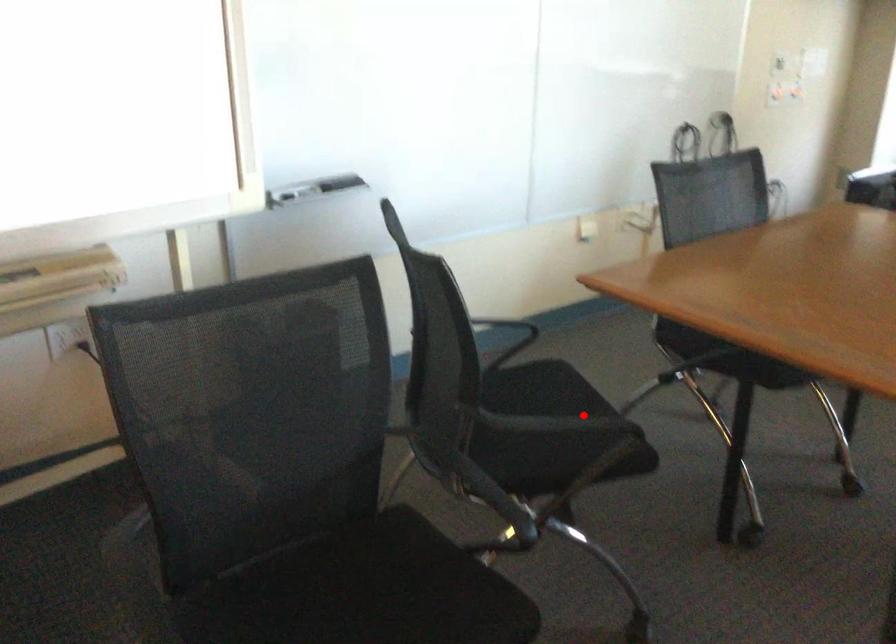
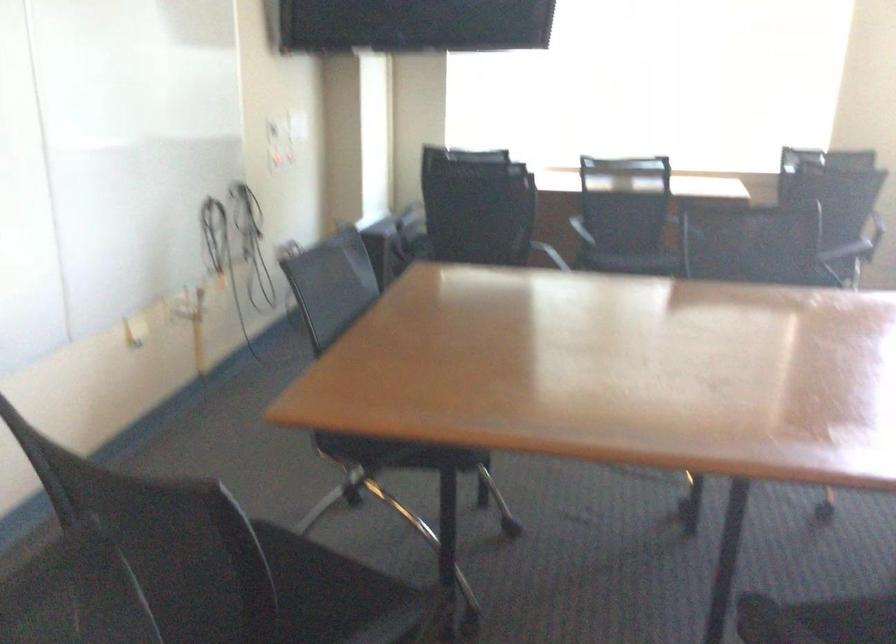
Question: I am providing you with two images of the same scene from different viewpoints. Image1 has a red point marked. In image2, the corresponding 3D location appears at what relative position? Reply with the corresponding letter.

Choices:
 (A) Closer
 (B) Farther

Answer: (A)